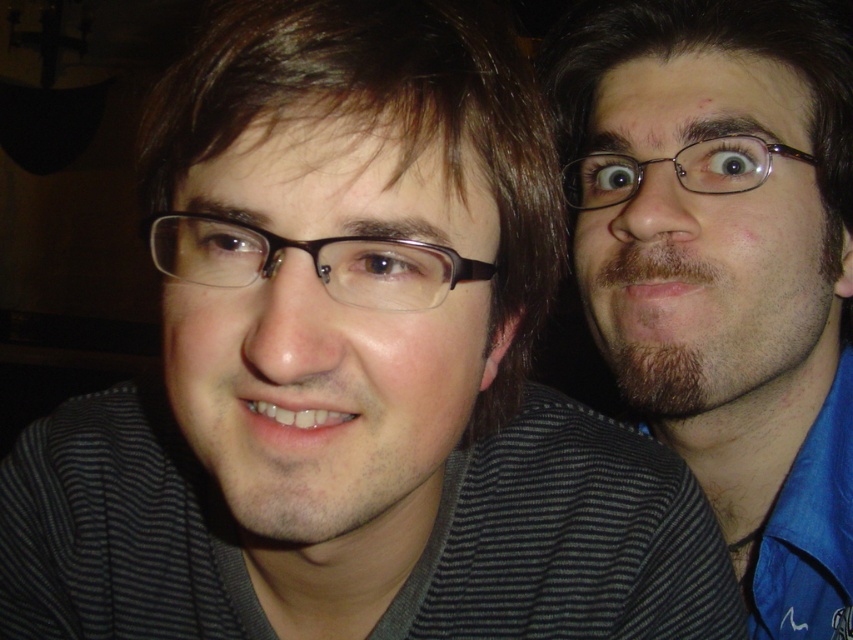
You are taking a photo with a camera. The camera is 24.38 inches away from the point at coordinates point (798,141). If you want to ensure that both people in the image are in focus, what adjustment should you make to the camera?

To ensure both people are in focus, adjust the camera so that the depth of field includes both subjects. Since the camera is 24.38 inches away from the point at coordinates point (798,141), you can increase the fstop number to narrow the aperture, which increases the depth of field, ensuring both subjects are sharp.

You are taking a photo of two people standing in front of a blurred background. You need to place a small sticker on the point that is closer to the camera. Which point should you choose between the point at (840, 433) and the point at (694, 189)?

The point at (694, 189) is closer to the camera than point at (840, 433), so you should place the sticker on the point at (694, 189).

You are taking a photo of two people wearing glasses. You notice the matte brown glasses at center and the black plastic glasses at upper right. Which pair is closer to the camera?

The matte brown glasses at center is closer to the camera because it is in front of the black plastic glasses at upper right.